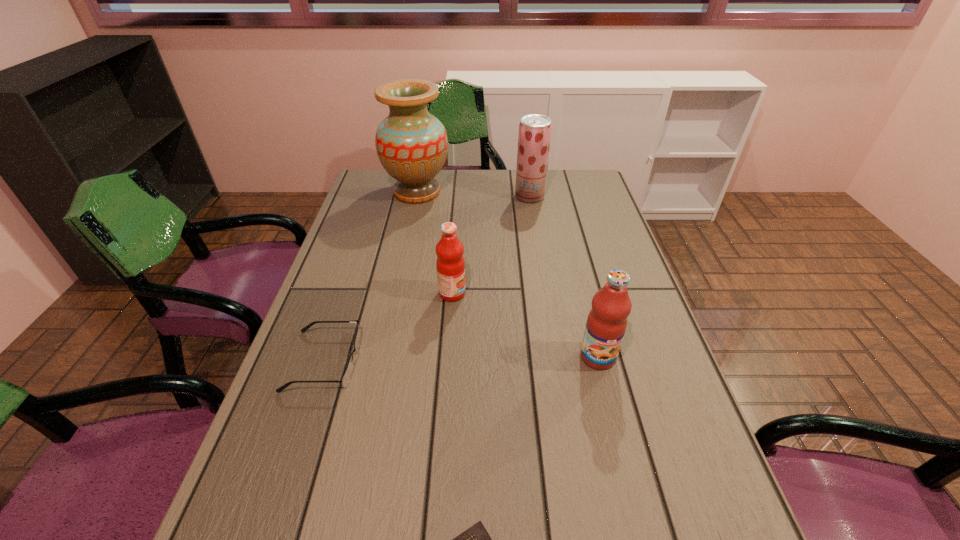
The image size is (960, 540). In the image, there is a desktop. Find the location of `vacant space at the left edge`. vacant space at the left edge is located at coordinates (377, 263).

In the image, there is a desktop. At what (x,y) coordinates should I click in order to perform the action: click on vacant space at the right edge. Please return your answer as a coordinate pair (x, y). Image resolution: width=960 pixels, height=540 pixels. Looking at the image, I should click on (670, 458).

Where is `free spot at the far left corner of the desktop`? The width and height of the screenshot is (960, 540). free spot at the far left corner of the desktop is located at coordinates (382, 195).

What are the coordinates of `free space at the far right corner of the desktop` in the screenshot? It's located at (551, 172).

At what (x,y) coordinates should I click in order to perform the action: click on vacant space in between the second nearest fruit juice and the second fruit juice from left to right. Please return your answer as a coordinate pair (x, y). This screenshot has height=540, width=960. Looking at the image, I should click on (491, 245).

Locate an element on the screen. The width and height of the screenshot is (960, 540). blank region between the fifth tallest object and the farthest fruit juice is located at coordinates (427, 279).

I want to click on free space between the third farthest object and the tallest object, so click(435, 242).

Find the location of a particular element. This screenshot has height=540, width=960. free point between the second shortest object and the rightmost fruit juice is located at coordinates (461, 359).

Where is `unoccupied position between the second object from right to left and the rightmost object`? This screenshot has width=960, height=540. unoccupied position between the second object from right to left and the rightmost object is located at coordinates point(564,276).

The height and width of the screenshot is (540, 960). In order to click on vacant space in between the vase and the fifth tallest object in this screenshot , I will do `click(371, 276)`.